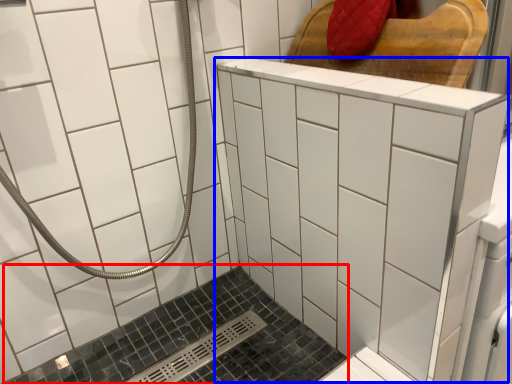
Question: Among these objects, which one is farthest to the camera, bath (highlighted by a red box) or ceramic tile (highlighted by a blue box)?

Choices:
 (A) bath
 (B) ceramic tile

Answer: (A)